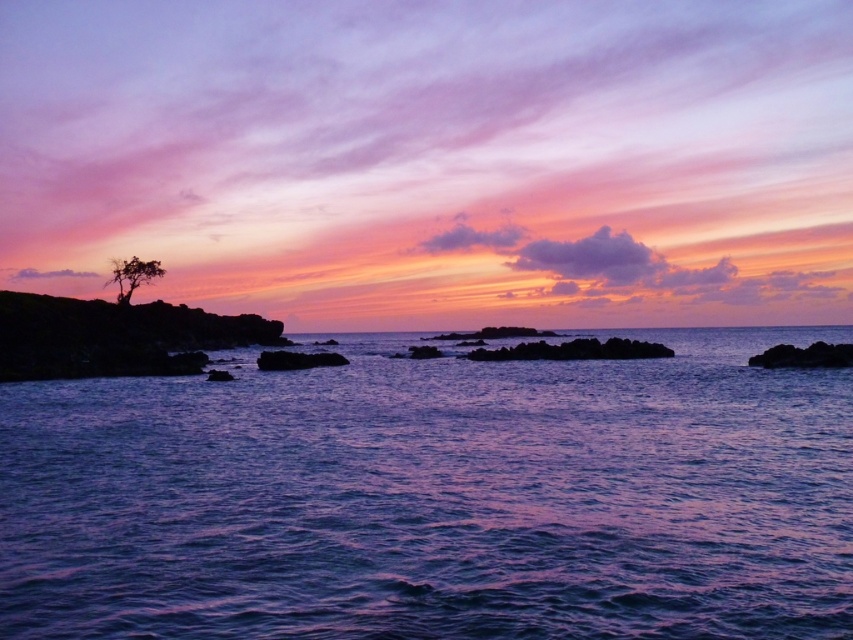
Question: Is purple translucent water at center further to camera compared to silhouette tree at left?

Choices:
 (A) no
 (B) yes

Answer: (A)

Question: Where is purple translucent water at center located in relation to silhouette tree at left in the image?

Choices:
 (A) right
 (B) left

Answer: (A)

Question: Which point is farther from the camera taking this photo?

Choices:
 (A) (132, 288)
 (B) (450, 381)

Answer: (A)

Question: Is purple translucent water at center smaller than silhouette tree at left?

Choices:
 (A) no
 (B) yes

Answer: (A)